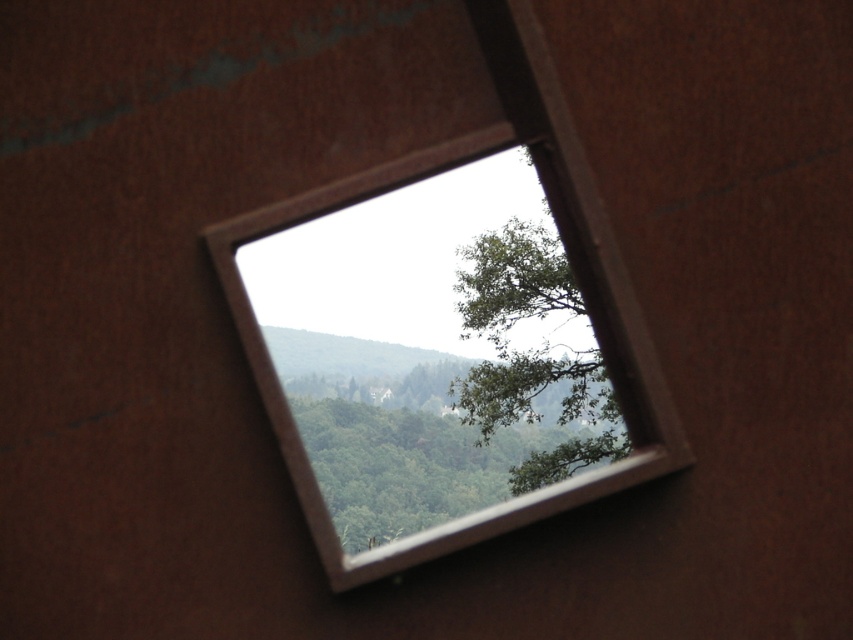
Is metallic silver window frame at center thinner than green leafy tree at upper center?

Incorrect, metallic silver window frame at center's width is not less than green leafy tree at upper center's.

Can you confirm if metallic silver window frame at center is taller than green leafy tree at upper center?

Yes.

Between point (357, 563) and point (577, 358), which one is positioned behind?

Point (577, 358)

This screenshot has width=853, height=640. Find the location of `metallic silver window frame at center`. metallic silver window frame at center is located at coordinates (599, 323).